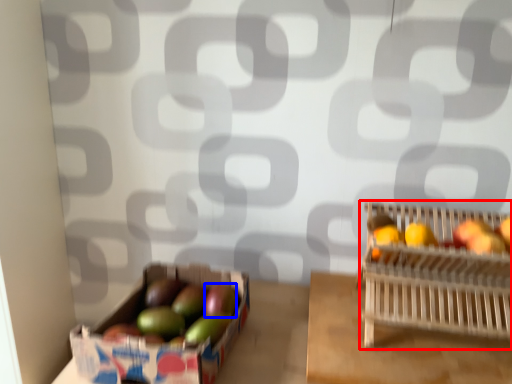
Question: Which of the following is the farthest to the observer, basket (highlighted by a red box) or apple (highlighted by a blue box)?

Choices:
 (A) basket
 (B) apple

Answer: (B)